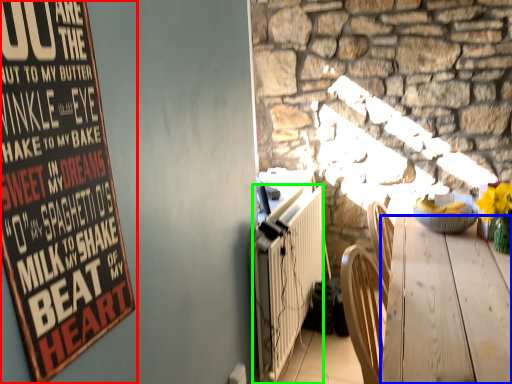
Question: Which object is positioned closest to poster (highlighted by a red box)? Select from desk (highlighted by a blue box) and radiator (highlighted by a green box).

Choices:
 (A) desk
 (B) radiator

Answer: (A)